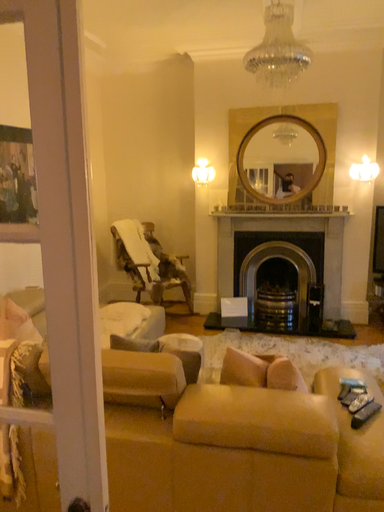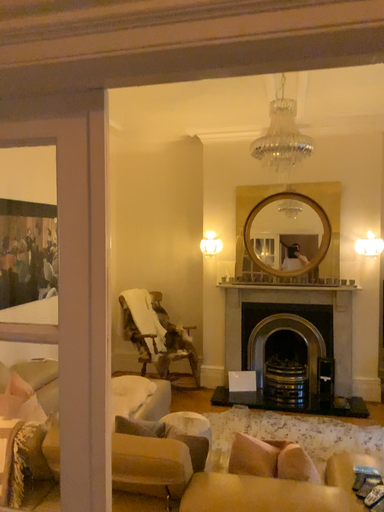
Question: How did the camera likely rotate when shooting the video?

Choices:
 (A) rotated upward
 (B) rotated downward

Answer: (A)